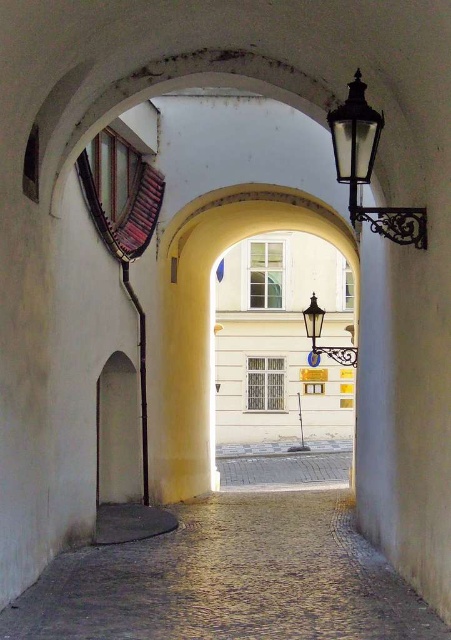
Question: Can you confirm if black glass lamp at upper right is bigger than polished brass lantern at center?

Choices:
 (A) yes
 (B) no

Answer: (B)

Question: Which point is farther from the camera taking this photo?

Choices:
 (A) (307, 324)
 (B) (368, 116)

Answer: (A)

Question: Which object is closer to the camera taking this photo?

Choices:
 (A) polished brass lantern at center
 (B) black glass lamp at upper right
 (C) cobblestone at center

Answer: (B)

Question: Does cobblestone at center have a smaller size compared to black glass lamp at upper right?

Choices:
 (A) no
 (B) yes

Answer: (B)

Question: Does cobblestone at center have a smaller size compared to black glass lamp at upper right?

Choices:
 (A) no
 (B) yes

Answer: (B)

Question: Which object is farther from the camera taking this photo?

Choices:
 (A) polished brass lantern at center
 (B) black glass lamp at upper right

Answer: (A)